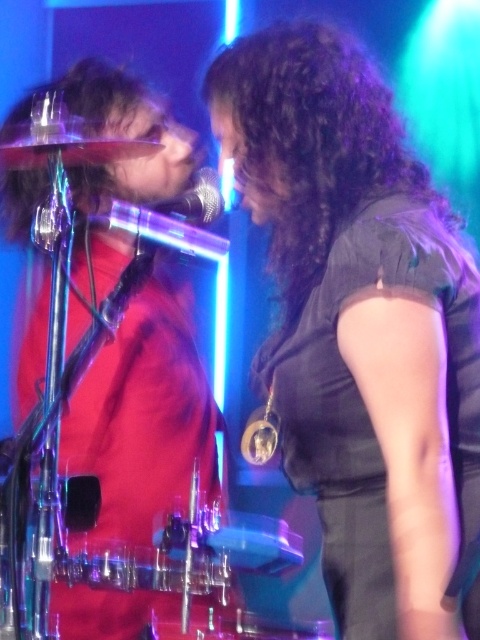
Question: Which of the following is the closest to the observer?

Choices:
 (A) (475, 625)
 (B) (132, 371)

Answer: (A)

Question: Considering the relative positions of black matte dress at center and red matte shirt at left in the image provided, where is black matte dress at center located with respect to red matte shirt at left?

Choices:
 (A) above
 (B) below

Answer: (A)

Question: Observing the image, what is the correct spatial positioning of black matte dress at center in reference to red matte shirt at left?

Choices:
 (A) above
 (B) below

Answer: (A)

Question: Is black matte dress at center bigger than red matte shirt at left?

Choices:
 (A) no
 (B) yes

Answer: (A)